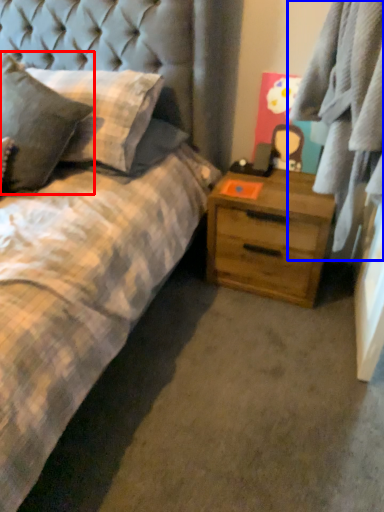
Question: Among these objects, which one is farthest to the camera, pillow (highlighted by a red box) or plaid (highlighted by a blue box)?

Choices:
 (A) pillow
 (B) plaid

Answer: (A)